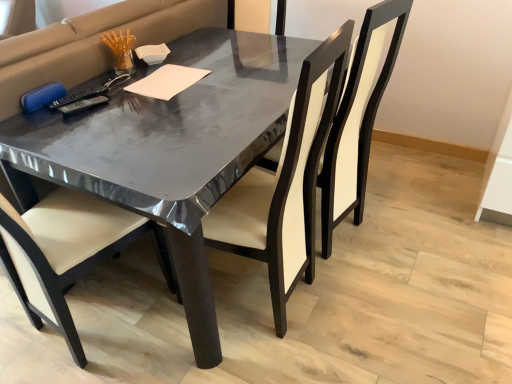
Question: Is matte black chair at center, which ranks as the second chair in left-to-right order, completely or partially outside of matte black chair at center, acting as the 1th chair starting from the left?

Choices:
 (A) no
 (B) yes

Answer: (B)

Question: From the image's perspective, is matte black chair at center, which ranks as the second chair in left-to-right order, over matte black chair at center, the second chair positioned from the right?

Choices:
 (A) yes
 (B) no

Answer: (A)

Question: From the image's perspective, is matte black chair at center, the first chair positioned from the right, located beneath matte black chair at center, acting as the 1th chair starting from the left?

Choices:
 (A) no
 (B) yes

Answer: (A)

Question: Can you confirm if matte black chair at center, which ranks as the second chair in left-to-right order, is smaller than matte black chair at center, acting as the 1th chair starting from the left?

Choices:
 (A) yes
 (B) no

Answer: (B)

Question: Is matte black chair at center, which ranks as the second chair in left-to-right order, bigger than matte black chair at center, acting as the 1th chair starting from the left?

Choices:
 (A) yes
 (B) no

Answer: (A)

Question: Relative to white paper at center, is matte black chair at center, the second chair positioned from the right, in front or behind?

Choices:
 (A) front
 (B) behind

Answer: (A)

Question: Is matte black chair at center, the second chair positioned from the right, situated inside white paper at center or outside?

Choices:
 (A) inside
 (B) outside

Answer: (B)

Question: In terms of height, does matte black chair at center, the second chair positioned from the right, look taller or shorter compared to white paper at center?

Choices:
 (A) short
 (B) tall

Answer: (B)

Question: Considering the positions of matte black chair at center, acting as the 1th chair starting from the left, and white paper at center in the image, is matte black chair at center, acting as the 1th chair starting from the left, wider or thinner than white paper at center?

Choices:
 (A) thin
 (B) wide

Answer: (B)

Question: From a real-world perspective, relative to matte black chair at center, the first chair positioned from the right, is white paper at center vertically above or below?

Choices:
 (A) below
 (B) above

Answer: (B)

Question: In terms of size, does white paper at center appear bigger or smaller than matte black chair at center, which ranks as the second chair in left-to-right order?

Choices:
 (A) big
 (B) small

Answer: (B)

Question: In terms of height, does white paper at center look taller or shorter compared to matte black chair at center, which ranks as the second chair in left-to-right order?

Choices:
 (A) short
 (B) tall

Answer: (A)

Question: Based on their positions, is white paper at center located to the left or right of matte black chair at center, the first chair positioned from the right?

Choices:
 (A) right
 (B) left

Answer: (B)

Question: Based on their sizes in the image, would you say white paper at center is bigger or smaller than matte black chair at center, acting as the 1th chair starting from the left?

Choices:
 (A) big
 (B) small

Answer: (B)

Question: Is white paper at center taller or shorter than matte black chair at center, the second chair positioned from the right?

Choices:
 (A) short
 (B) tall

Answer: (A)